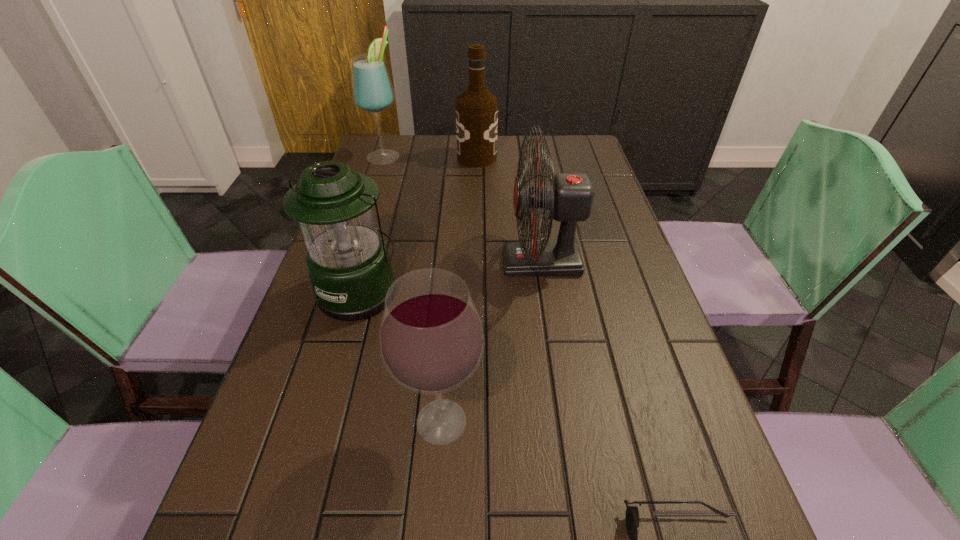
Locate an element on the screen. object that is the second nearest to the lantern is located at coordinates (569, 197).

Image resolution: width=960 pixels, height=540 pixels. Identify the location of the closest alcohol to the leftmost alcohol. (476, 108).

You are a GUI agent. You are given a task and a screenshot of the screen. Output one action in this format:
    pyautogui.click(x=<x>, y=<y>)
    Task: Click on the second closest alcohol to the leftmost alcohol
    This screenshot has width=960, height=540.
    Given the screenshot: What is the action you would take?
    pyautogui.click(x=431, y=338)

Locate an element on the screen. The image size is (960, 540). vacant space that satisfies the following two spatial constraints: 1. on the front-facing side of the fan; 2. on the front side of the lantern is located at coordinates (546, 291).